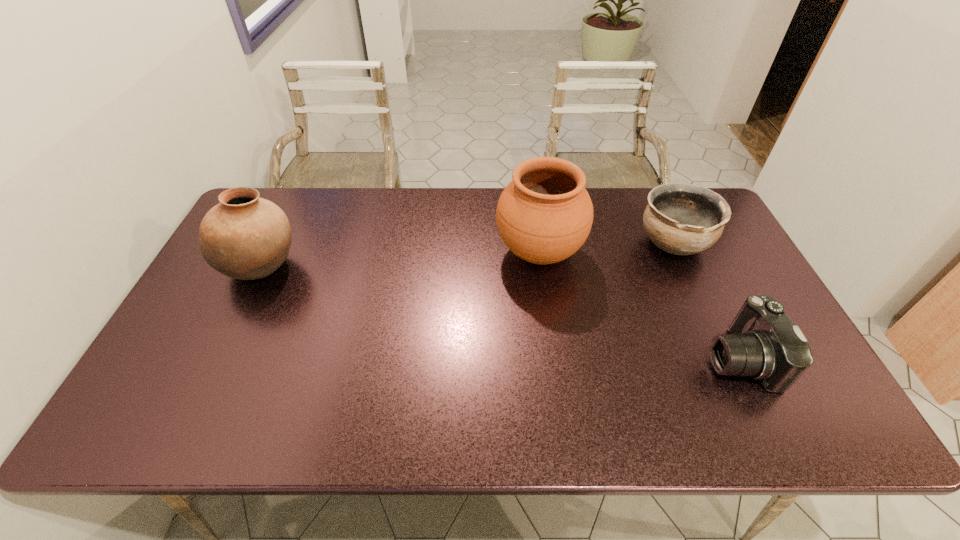
Identify which object is the nearest to the third object from right to left. Please provide its 2D coordinates. Your answer should be formatted as a tuple, i.e. [(x, y)], where the tuple contains the x and y coordinates of a point satisfying the conditions above.

[(682, 219)]

Select which pottery is the second closest to the second pottery from right to left. Please provide its 2D coordinates. Your answer should be formatted as a tuple, i.e. [(x, y)], where the tuple contains the x and y coordinates of a point satisfying the conditions above.

[(245, 237)]

Locate which pottery ranks in proximity to the camera. Please provide its 2D coordinates. Your answer should be formatted as a tuple, i.e. [(x, y)], where the tuple contains the x and y coordinates of a point satisfying the conditions above.

[(682, 219)]

Where is `vacant region that satisfies the following two spatial constraints: 1. on the back side of the second object from left to right; 2. on the left side of the leftmost object`? vacant region that satisfies the following two spatial constraints: 1. on the back side of the second object from left to right; 2. on the left side of the leftmost object is located at coordinates (269, 253).